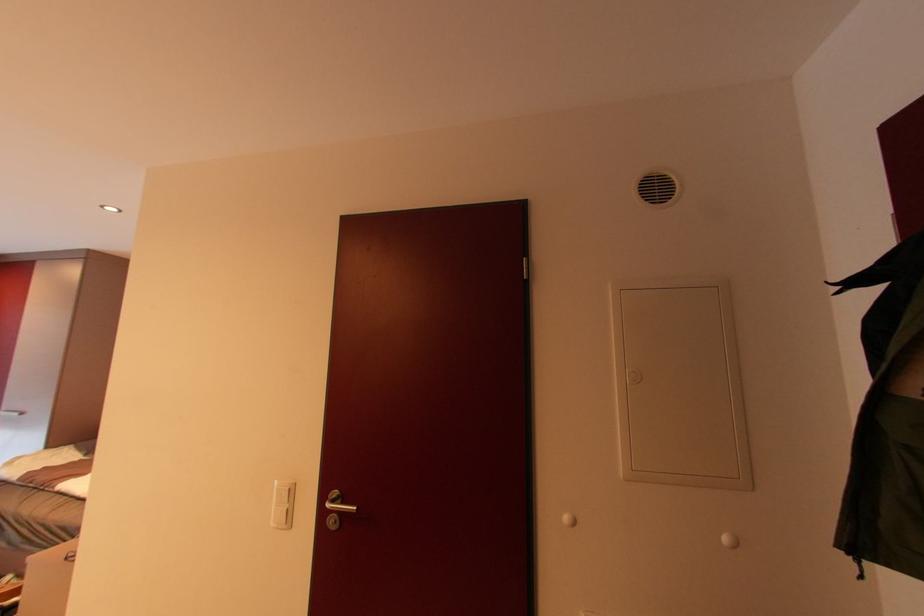
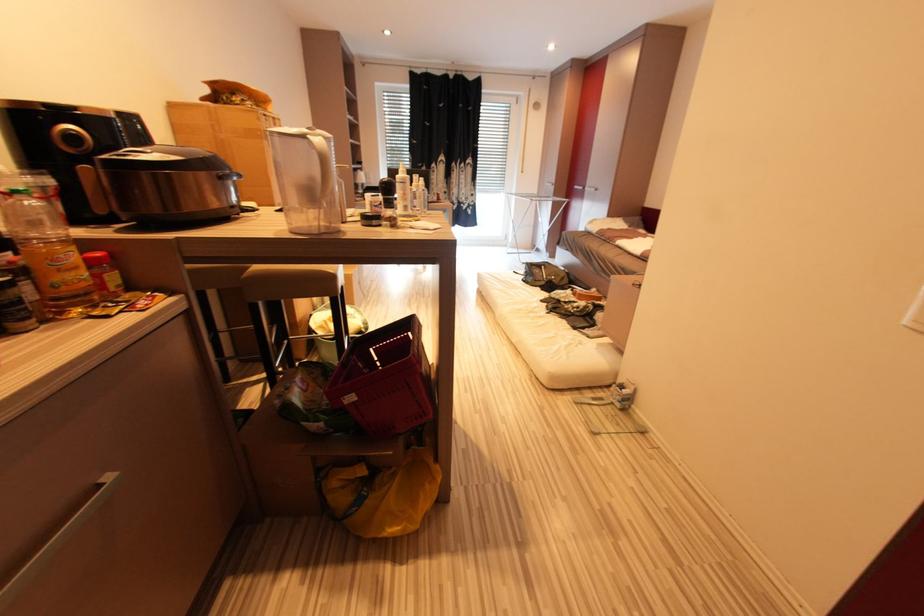
The images are taken continuously from a first-person perspective. In which direction is your viewpoint rotating?

The camera rotated toward left-down.